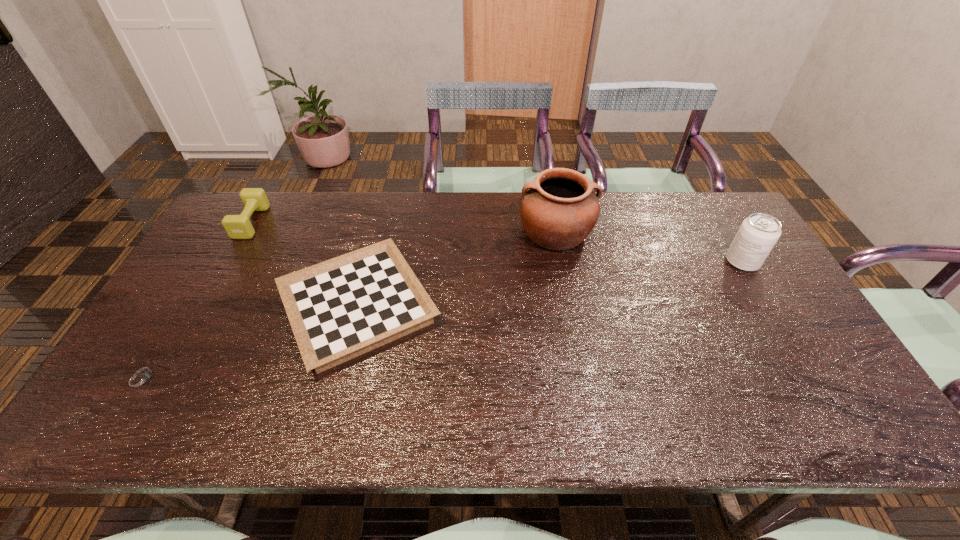
Locate an element on the screen. the fourth object from left to right is located at coordinates (559, 209).

This screenshot has height=540, width=960. Find the location of `pottery`. pottery is located at coordinates (559, 209).

This screenshot has height=540, width=960. Identify the location of soda can. (758, 233).

What are the coordinates of `the rightmost object` in the screenshot? It's located at (758, 233).

Identify the location of dumbbell. Image resolution: width=960 pixels, height=540 pixels. (254, 199).

You are a GUI agent. You are given a task and a screenshot of the screen. Output one action in this format:
    pyautogui.click(x=<x>, y=<y>)
    Task: Click on the third object from right to left
    Image resolution: width=960 pixels, height=540 pixels.
    Given the screenshot: What is the action you would take?
    pyautogui.click(x=339, y=309)

The height and width of the screenshot is (540, 960). I want to click on the second shortest object, so click(x=339, y=309).

The image size is (960, 540). What are the coordinates of `the shortest object` in the screenshot? It's located at (142, 377).

Where is `vacant region located 0.390m on the right of the pottery`? vacant region located 0.390m on the right of the pottery is located at coordinates (714, 232).

Identify the location of blank space located 0.260m on the back of the soda can. (706, 200).